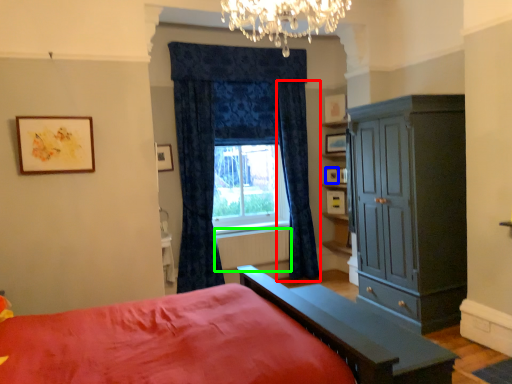
Question: Which object is the closest to the curtain (highlighted by a red box)? Choose among these: picture frame (highlighted by a blue box) or radiator (highlighted by a green box).

Choices:
 (A) picture frame
 (B) radiator

Answer: (B)